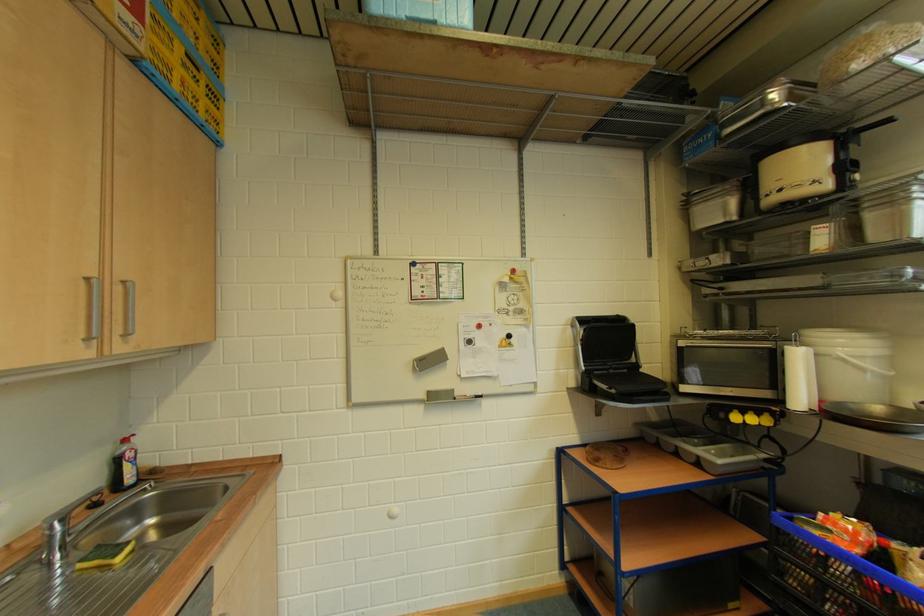
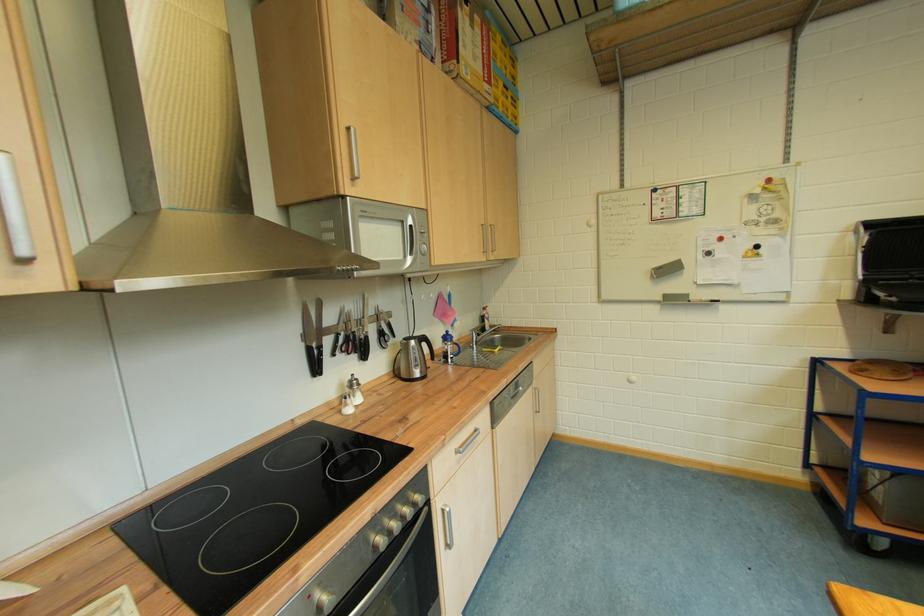
Find the pixel in the second image that matches point (604, 467) in the first image.

(868, 377)